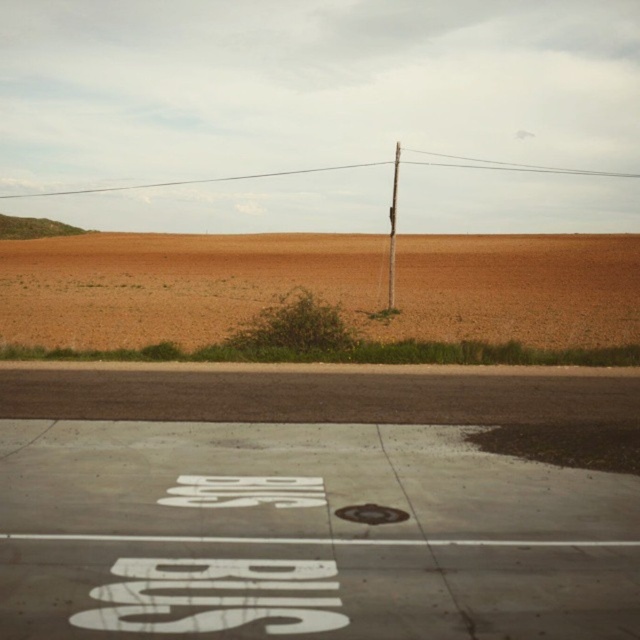
What do you see at coordinates (320, 288) in the screenshot? Image resolution: width=640 pixels, height=640 pixels. I see `brown grassland at center` at bounding box center [320, 288].

Which of these two, brown grassland at center or smooth wood pole at center, stands taller?

smooth wood pole at center is taller.

What do you see at coordinates (320, 288) in the screenshot? I see `brown grassland at center` at bounding box center [320, 288].

Where is `brown grassland at center`? brown grassland at center is located at coordinates (320, 288).

Does white painted concrete at center appear on the left side of smooth wood pole at center?

Yes, white painted concrete at center is to the left of smooth wood pole at center.

Who is higher up, white painted concrete at center or smooth wood pole at center?

smooth wood pole at center

Find the location of a particular element. The image size is (640, 640). white painted concrete at center is located at coordinates (x=307, y=508).

Can you confirm if white painted concrete at center is positioned to the right of brown grassland at center?

In fact, white painted concrete at center is to the left of brown grassland at center.

Find the location of `white painted concrete at center`. white painted concrete at center is located at coordinates (307, 508).

Find the location of a particular element. This screenshot has width=640, height=640. white painted concrete at center is located at coordinates (x=307, y=508).